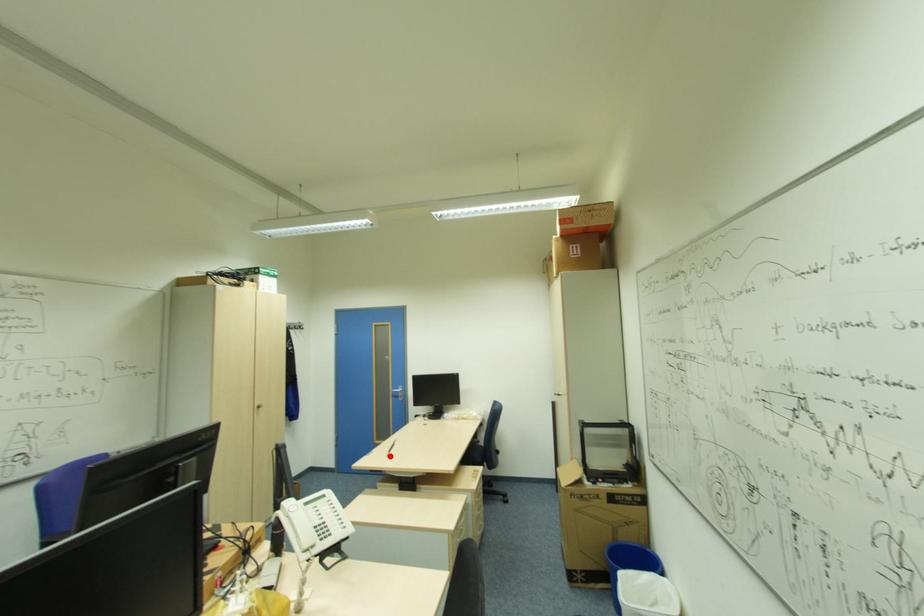
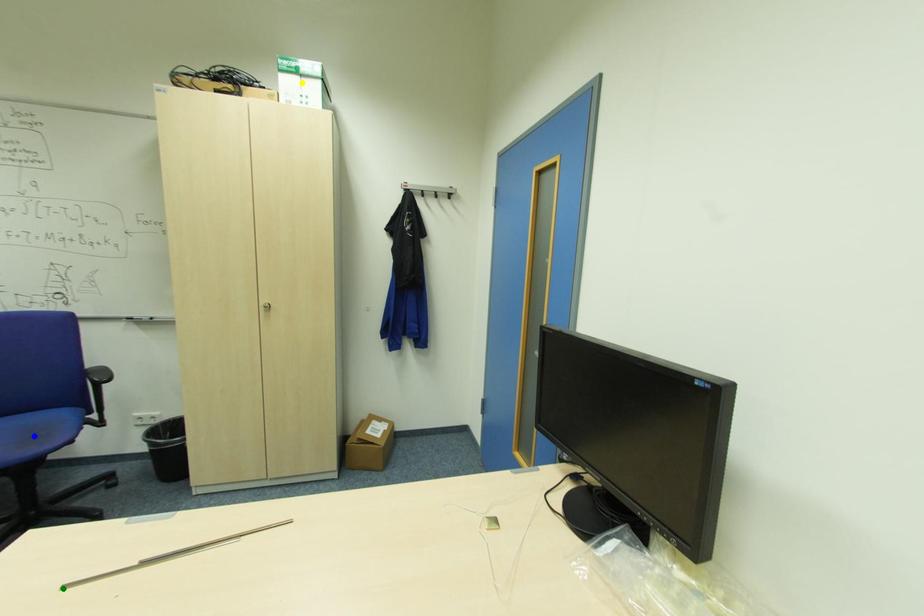
Question: I am providing you with two images of the same scene from different viewpoints. A red point is marked on the first image. You are given multiple points on the second image. Which point in image 2 represents the same 3d spot as the red point in image 1?

Choices:
 (A) green point
 (B) yellow point
 (C) blue point

Answer: (A)